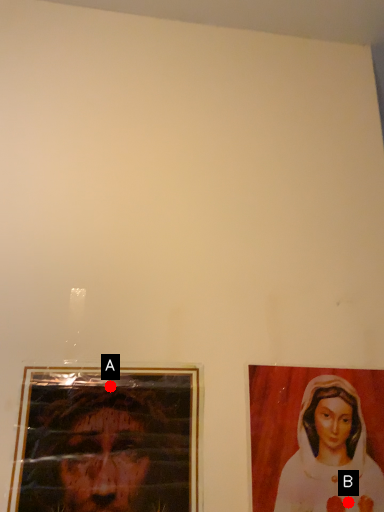
Question: Two points are circled on the image, labeled by A and B beside each circle. Which point appears closest to the camera in this image?

Choices:
 (A) A is closer
 (B) B is closer

Answer: (A)